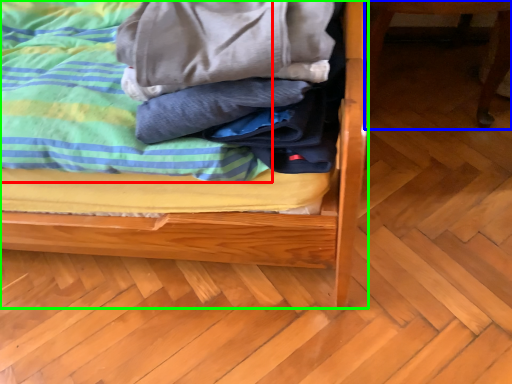
Question: Considering the real-world distances, which object is farthest from blanket (highlighted by a red box)? furniture (highlighted by a blue box) or bed (highlighted by a green box)?

Choices:
 (A) furniture
 (B) bed

Answer: (A)